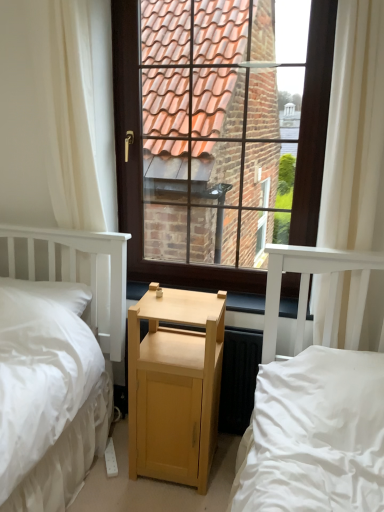
Question: Is wooden at center next to white sheer curtain at upper right, arranged as the first curtain when viewed from the right?

Choices:
 (A) yes
 (B) no

Answer: (B)

Question: From the image's perspective, is wooden at center located beneath white sheer curtain at upper right, the 2th curtain from the left?

Choices:
 (A) yes
 (B) no

Answer: (A)

Question: Is wooden at center smaller than white sheer curtain at upper right, arranged as the first curtain when viewed from the right?

Choices:
 (A) yes
 (B) no

Answer: (A)

Question: Is there a large distance between wooden at center and white sheer curtain at upper right, arranged as the first curtain when viewed from the right?

Choices:
 (A) yes
 (B) no

Answer: (B)

Question: Does wooden at center have a larger size compared to white sheer curtain at upper right, the 2th curtain from the left?

Choices:
 (A) yes
 (B) no

Answer: (B)

Question: From a real-world perspective, does wooden at center stand above white sheer curtain at upper right, arranged as the first curtain when viewed from the right?

Choices:
 (A) no
 (B) yes

Answer: (A)

Question: Can you see white sheer curtain at upper right, the 2th curtain from the left, touching white soft pillow at left?

Choices:
 (A) yes
 (B) no

Answer: (B)

Question: Does white sheer curtain at upper right, the 2th curtain from the left, have a greater height compared to white soft pillow at left?

Choices:
 (A) yes
 (B) no

Answer: (A)

Question: Is white sheer curtain at upper right, arranged as the first curtain when viewed from the right, positioned far away from white soft pillow at left?

Choices:
 (A) yes
 (B) no

Answer: (A)

Question: Does white sheer curtain at upper right, the 2th curtain from the left, appear on the right side of white soft pillow at left?

Choices:
 (A) yes
 (B) no

Answer: (A)

Question: Is the position of white sheer curtain at upper right, the 2th curtain from the left, more distant than that of white soft pillow at left?

Choices:
 (A) no
 (B) yes

Answer: (A)

Question: Considering the relative sizes of white sheer curtain at upper right, arranged as the first curtain when viewed from the right, and white soft pillow at left in the image provided, is white sheer curtain at upper right, arranged as the first curtain when viewed from the right, thinner than white soft pillow at left?

Choices:
 (A) yes
 (B) no

Answer: (A)

Question: Does white sheer curtain at left, positioned as the second curtain in right-to-left order, have a larger size compared to light wood bed at center?

Choices:
 (A) no
 (B) yes

Answer: (A)